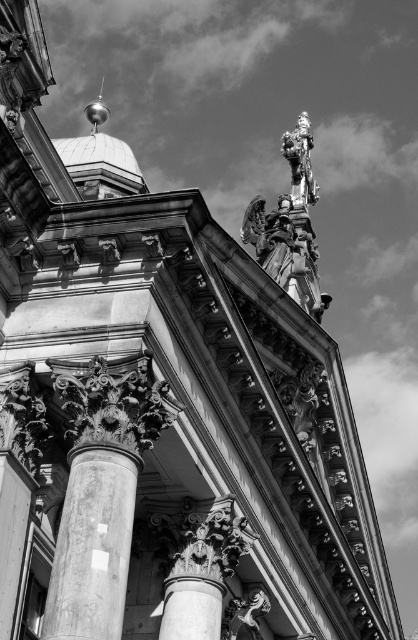
Question: Is the position of marble column at center more distant than that of white glossy dome at center?

Choices:
 (A) no
 (B) yes

Answer: (A)

Question: Which object is farther from the camera taking this photo?

Choices:
 (A) marble column at center
 (B) white glossy dome at center

Answer: (B)

Question: Can you confirm if marble column at center is positioned to the right of white glossy dome at center?

Choices:
 (A) no
 (B) yes

Answer: (B)

Question: Which of the following is the closest to the observer?

Choices:
 (A) white glossy dome at center
 (B) marble column at center

Answer: (B)

Question: Which object appears farthest from the camera in this image?

Choices:
 (A) marble column at center
 (B) white glossy dome at center

Answer: (B)

Question: Does marble column at center have a lesser width compared to white glossy dome at center?

Choices:
 (A) yes
 (B) no

Answer: (A)